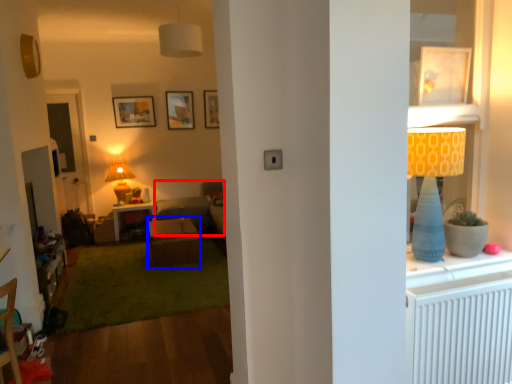
Question: Among these objects, which one is nearest to the camera, studio couch (highlighted by a red box) or table (highlighted by a blue box)?

Choices:
 (A) studio couch
 (B) table

Answer: (B)